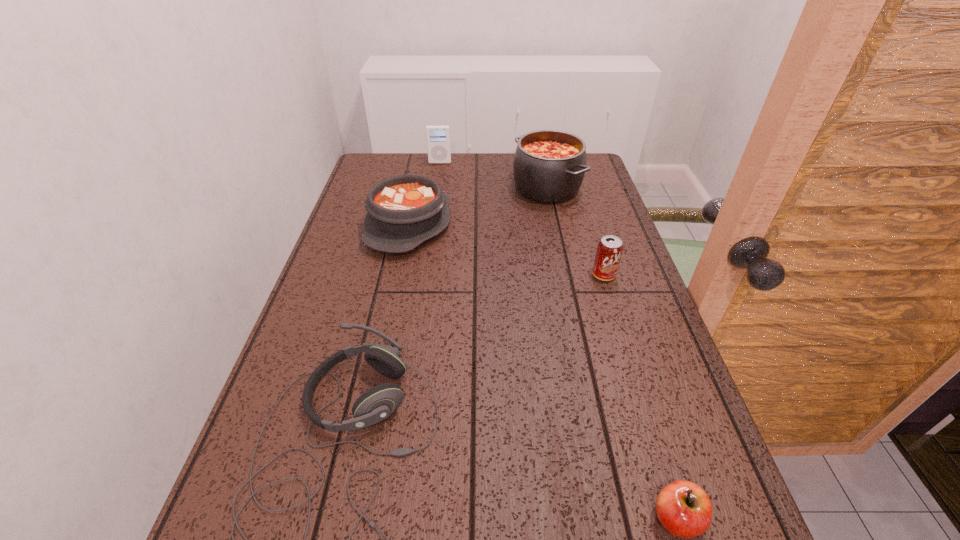
The width and height of the screenshot is (960, 540). Find the location of `empty location between the taller casserole and the left casserole`. empty location between the taller casserole and the left casserole is located at coordinates (478, 206).

Where is `object that is the second closest to the apple`? object that is the second closest to the apple is located at coordinates (609, 250).

Identify which object is located as the third nearest to the soda can. Please provide its 2D coordinates. Your answer should be formatted as a tuple, i.e. [(x, y)], where the tuple contains the x and y coordinates of a point satisfying the conditions above.

[(376, 404)]

Locate an element on the screen. The width and height of the screenshot is (960, 540). vacant region that satisfies the following two spatial constraints: 1. on the front-facing side of the iPod; 2. on the right side of the right casserole is located at coordinates (437, 188).

Find the location of a particular element. free space that satisfies the following two spatial constraints: 1. on the front-facing side of the farthest object; 2. on the right side of the taller casserole is located at coordinates (437, 188).